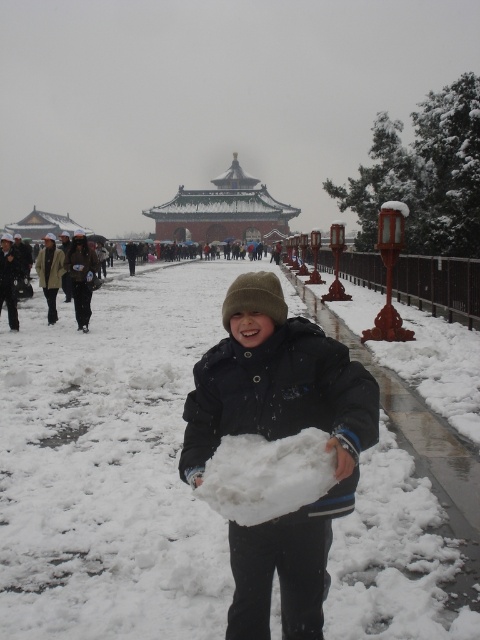
Image resolution: width=480 pixels, height=640 pixels. Describe the element at coordinates (109, 467) in the screenshot. I see `white fluffy snow at center` at that location.

Which is behind, point (338, 589) or point (335, 497)?

The point (338, 589) is more distant.

Which is behind, point (37, 396) or point (287, 525)?

Positioned behind is point (37, 396).

Locate an element on the screen. The width and height of the screenshot is (480, 640). white fluffy snow at center is located at coordinates (109, 467).